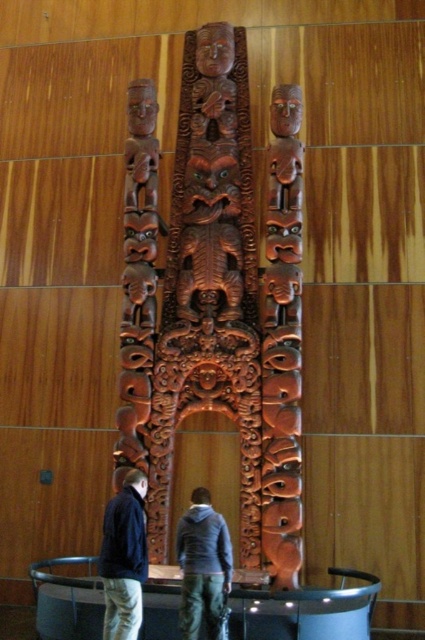
Who is higher up, dark gray hoodie at center or dark blue jacket at lower left?

dark blue jacket at lower left is higher up.

Can you confirm if dark gray hoodie at center is positioned to the left of dark blue jacket at lower left?

Incorrect, dark gray hoodie at center is not on the left side of dark blue jacket at lower left.

Measure the distance between dark gray hoodie at center and camera.

They are 37.03 meters apart.

Find the location of a particular element. The image size is (425, 640). dark gray hoodie at center is located at coordinates (124, 557).

Does dark gray hoodie at center appear on the right side of gray hoodie at center?

In fact, dark gray hoodie at center is to the left of gray hoodie at center.

Describe the element at coordinates (124, 557) in the screenshot. I see `dark gray hoodie at center` at that location.

You are a GUI agent. You are given a task and a screenshot of the screen. Output one action in this format:
    pyautogui.click(x=<x>, y=<y>)
    Task: Click on the dark gray hoodie at center
    Image resolution: width=425 pixels, height=640 pixels.
    Given the screenshot: What is the action you would take?
    pyautogui.click(x=124, y=557)

Is dark blue jacket at lower left wider than gray hoodie at center?

Yes.

Is dark blue jacket at lower left bigger than gray hoodie at center?

Yes, dark blue jacket at lower left is bigger than gray hoodie at center.

Between point (136, 513) and point (181, 545), which one is positioned behind?

The point (181, 545) is more distant.

Image resolution: width=425 pixels, height=640 pixels. Identify the location of dark blue jacket at lower left. (124, 557).